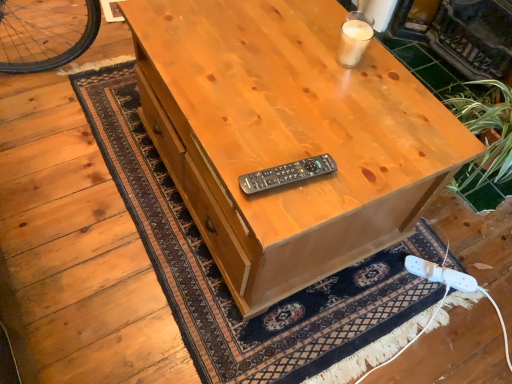
This screenshot has width=512, height=384. I want to click on green tile fireplace at upper right, so click(461, 33).

Image resolution: width=512 pixels, height=384 pixels. Find the location of `black plastic remote at center`. black plastic remote at center is located at coordinates (287, 174).

Is black plastic remote at center a part of natural wood desk at center?

Definitely not — black plastic remote at center is not inside natural wood desk at center.

Considering the relative sizes of natural wood desk at center and black plastic remote at center in the image provided, is natural wood desk at center thinner than black plastic remote at center?

No, natural wood desk at center is not thinner than black plastic remote at center.

Based on their positions, is natural wood desk at center located to the left or right of black plastic remote at center?

In the image, natural wood desk at center appears on the left side of black plastic remote at center.

From a real-world perspective, is natural wood desk at center physically above black plastic remote at center?

No, from a real-world perspective, natural wood desk at center is not above black plastic remote at center.

From a real-world perspective, is white plastic game controller at lower right positioned under natural wood desk at center based on gravity?

Correct, in the physical world, white plastic game controller at lower right is lower than natural wood desk at center.

From the image's perspective, which one is positioned lower, white plastic game controller at lower right or natural wood desk at center?

From the image's view, white plastic game controller at lower right is below.

Which is closer, (426, 275) or (285, 7)?

Clearly, point (426, 275) is more distant from the camera than point (285, 7).

Which of these two, white plastic game controller at lower right or natural wood desk at center, is bigger?

With larger size is natural wood desk at center.

Is green tile fireplace at upper right facing away from white plastic game controller at lower right?

No, green tile fireplace at upper right is not facing the opposite direction of white plastic game controller at lower right.

Is there a large distance between green tile fireplace at upper right and white plastic game controller at lower right?

Absolutely, green tile fireplace at upper right is distant from white plastic game controller at lower right.

Locate an element on the screen. The height and width of the screenshot is (384, 512). game controller below the green tile fireplace at upper right (from a real-world perspective) is located at coordinates (440, 274).

Which of these two, green tile fireplace at upper right or white plastic game controller at lower right, is bigger?

Bigger between the two is green tile fireplace at upper right.

The height and width of the screenshot is (384, 512). Identify the location of fireplace behind the black plastic remote at center. (461, 33).

Considering the points (511, 83) and (274, 180), which point is behind, point (511, 83) or point (274, 180)?

The point (511, 83) is farther from the camera.

What's the angular difference between green tile fireplace at upper right and black plastic remote at center's facing directions?

171 degrees.

In the scene shown: Can you confirm if green tile fireplace at upper right is thinner than black plastic remote at center?

In fact, green tile fireplace at upper right might be wider than black plastic remote at center.

From the image's perspective, does white plastic game controller at lower right appear lower than green tile fireplace at upper right?

Yes, from the image's perspective, white plastic game controller at lower right is beneath green tile fireplace at upper right.

From a real-world perspective, is white plastic game controller at lower right physically above green tile fireplace at upper right?

Actually, white plastic game controller at lower right is physically below green tile fireplace at upper right in the real world.

Is point (430, 274) less distant than point (490, 49)?

Yes, point (430, 274) is in front of point (490, 49).

Which object is positioned more to the left, white plastic game controller at lower right or green tile fireplace at upper right?

white plastic game controller at lower right.

Considering the relative sizes of black plastic remote at center and green tile fireplace at upper right in the image provided, is black plastic remote at center taller than green tile fireplace at upper right?

In fact, black plastic remote at center may be shorter than green tile fireplace at upper right.

Consider the image. Considering the relative positions of black plastic remote at center and green tile fireplace at upper right in the image provided, is black plastic remote at center to the right of green tile fireplace at upper right from the viewer's perspective?

Incorrect, black plastic remote at center is not on the right side of green tile fireplace at upper right.

Which point is more forward, (284, 179) or (439, 25)?

The point (284, 179) is more forward.

Measure the distance between black plastic remote at center and green tile fireplace at upper right.

4.48 feet.

Can you see white plastic game controller at lower right touching black plastic remote at center?

There is a gap between white plastic game controller at lower right and black plastic remote at center.

Is point (472, 281) in front of point (282, 169)?

That is False.

Is white plastic game controller at lower right to the left of black plastic remote at center from the viewer's perspective?

In fact, white plastic game controller at lower right is to the right of black plastic remote at center.

From a real-world perspective, is white plastic game controller at lower right under black plastic remote at center?

Indeed, from a real-world perspective, white plastic game controller at lower right is positioned beneath black plastic remote at center.

At what (x,y) coordinates should I click in order to perform the action: click on control above the natural wood desk at center (from a real-world perspective). Please return your answer as a coordinate pair (x, y). Looking at the image, I should click on (287, 174).

Locate an element on the screen. The image size is (512, 384). game controller on the right side of natural wood desk at center is located at coordinates (440, 274).

Which object lies nearer to the anchor point white plastic game controller at lower right, natural wood desk at center or black plastic remote at center?

natural wood desk at center.

Looking at the image, which one is located further to black plastic remote at center, green tile fireplace at upper right or white plastic game controller at lower right?

green tile fireplace at upper right.

From the picture: Looking at the image, which one is located closer to natural wood desk at center, black plastic remote at center or green tile fireplace at upper right?

The object closer to natural wood desk at center is black plastic remote at center.

From the image, which object appears to be farther from green tile fireplace at upper right, natural wood desk at center or white plastic game controller at lower right?

white plastic game controller at lower right lies further to green tile fireplace at upper right than the other object.

From the image, which object appears to be nearer to natural wood desk at center, black plastic remote at center or white plastic game controller at lower right?

black plastic remote at center is closer to natural wood desk at center.

Based on their spatial positions, is white plastic game controller at lower right or black plastic remote at center further from green tile fireplace at upper right?

The object further to green tile fireplace at upper right is black plastic remote at center.

Based on their spatial positions, is green tile fireplace at upper right or black plastic remote at center further from white plastic game controller at lower right?

The object further to white plastic game controller at lower right is green tile fireplace at upper right.

Based on their spatial positions, is black plastic remote at center or natural wood desk at center further from white plastic game controller at lower right?

The object further to white plastic game controller at lower right is black plastic remote at center.

In order to click on control between green tile fireplace at upper right and white plastic game controller at lower right in the up-down direction in this screenshot , I will do `click(287, 174)`.

Where is `control situated between natural wood desk at center and green tile fireplace at upper right from left to right`? control situated between natural wood desk at center and green tile fireplace at upper right from left to right is located at coordinates (287, 174).

I want to click on control located between natural wood desk at center and white plastic game controller at lower right in the left-right direction, so click(x=287, y=174).

Locate an element on the screen. The width and height of the screenshot is (512, 384). desk between green tile fireplace at upper right and white plastic game controller at lower right in the vertical direction is located at coordinates (287, 137).